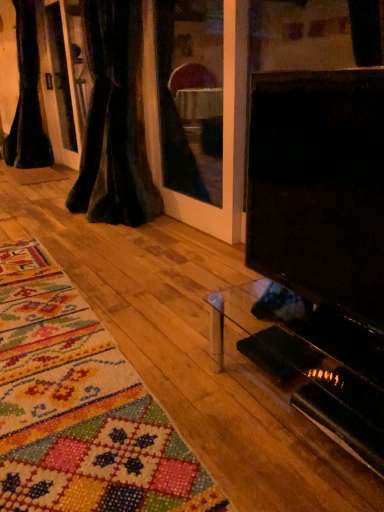
Question: Is black glossy tv at right spatially inside black velvet curtain at left, the second curtain positioned from the right, or outside of it?

Choices:
 (A) outside
 (B) inside

Answer: (A)

Question: Is black glossy tv at right taller or shorter than black velvet curtain at left, the second curtain positioned from the right?

Choices:
 (A) tall
 (B) short

Answer: (B)

Question: Based on their relative distances, which object is nearer to the black glossy tv at right?

Choices:
 (A) velvet dark at left, which is the first curtain in front-to-back order
 (B) black velvet curtain at left, marked as the 2th curtain in a front-to-back arrangement

Answer: (A)

Question: Estimate the real-world distances between objects in this image. Which object is closer to the velvet dark at left, which is the first curtain in front-to-back order?

Choices:
 (A) black velvet curtain at left, arranged as the first curtain when viewed from the back
 (B) black glossy tv at right

Answer: (A)